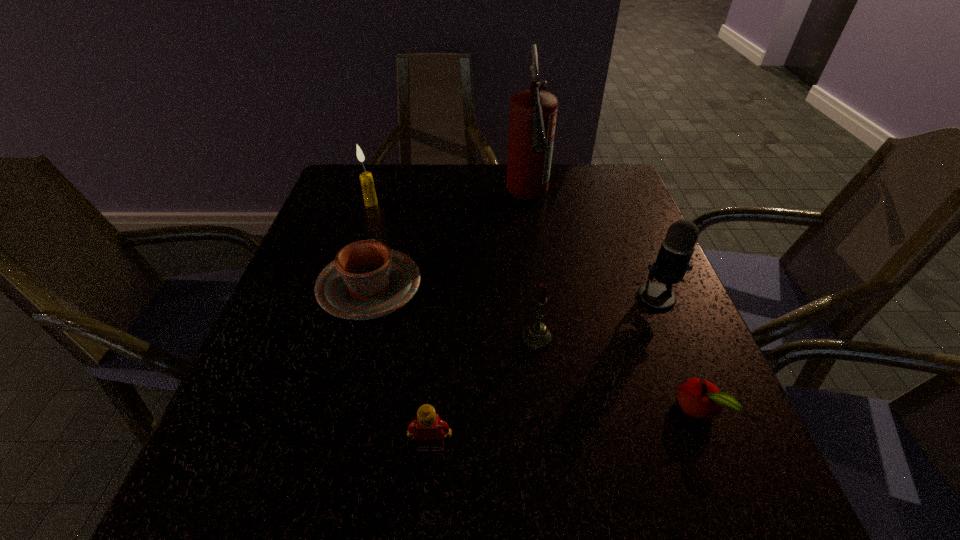
Find the location of a particular element. Image resolution: width=960 pixels, height=540 pixels. the tallest object is located at coordinates (533, 113).

Find the location of a particular element. microphone is located at coordinates (672, 263).

At what (x,y) coordinates should I click in order to perform the action: click on the taller candle. Please return your answer as a coordinate pair (x, y). Image resolution: width=960 pixels, height=540 pixels. Looking at the image, I should click on (366, 179).

This screenshot has height=540, width=960. I want to click on the farther candle, so click(x=366, y=179).

Locate an element on the screen. The image size is (960, 540). the right candle is located at coordinates (536, 336).

The image size is (960, 540). Find the location of `the fourth shortest object`. the fourth shortest object is located at coordinates click(x=536, y=336).

This screenshot has width=960, height=540. I want to click on the fifth object from right to left, so click(x=430, y=430).

At what (x,y) coordinates should I click in order to perform the action: click on the nearest object. Please return your answer as a coordinate pair (x, y). The image size is (960, 540). Looking at the image, I should click on (430, 430).

Find the location of a particular element. Image resolution: width=960 pixels, height=540 pixels. chinaware is located at coordinates (367, 280).

The height and width of the screenshot is (540, 960). I want to click on the shortest object, so click(x=700, y=399).